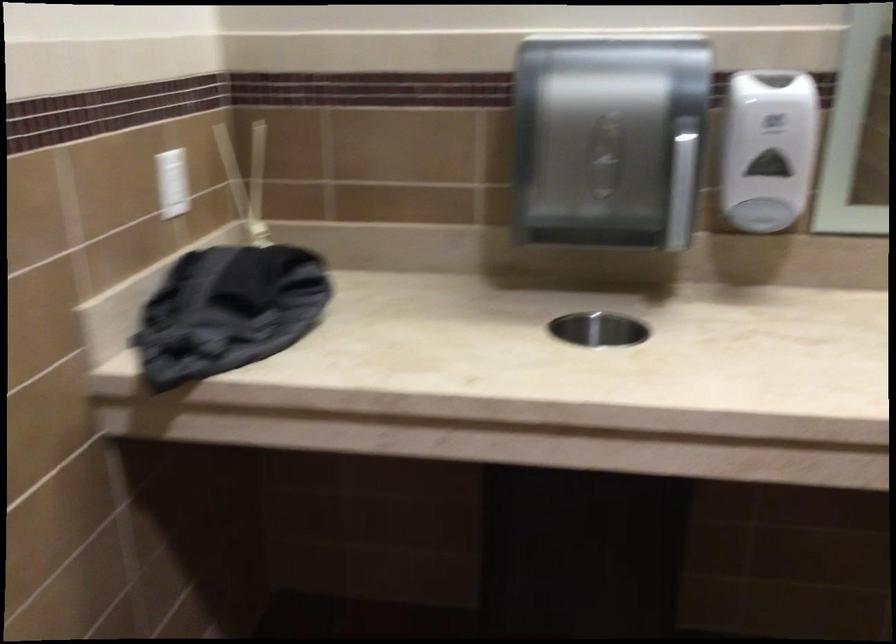
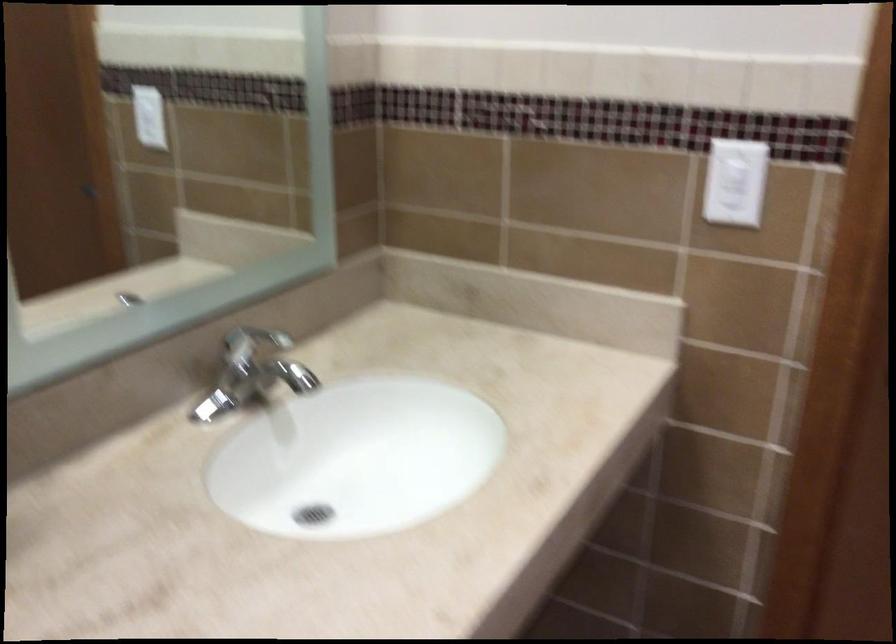
Question: Based on the continuous images, in which direction is the camera rotating? Reply with the corresponding letter.

Choices:
 (A) Left
 (B) Right
 (C) Up
 (D) Down

Answer: (B)